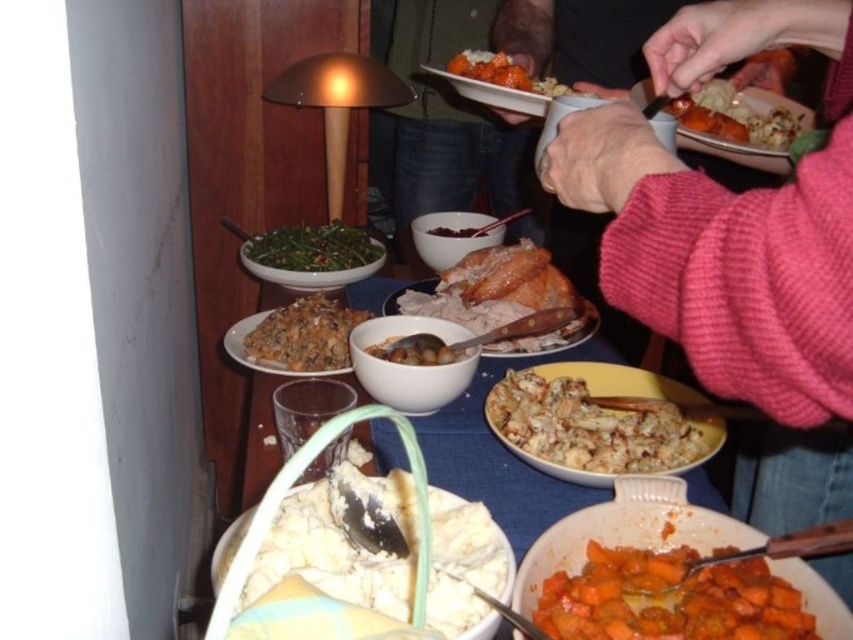
You are a guest at the table and want to place your napkin on the smooth white plate at center. However, there is also a golden brown roasted sweet potato at upper right nearby. Which object is wider so that the napkin can fit better?

The smooth white plate at center is wider than the golden brown roasted sweet potato at upper right, so the napkin will fit better on the smooth white plate at center.

You are standing in the dining area and want to reach the point marked as point (x=248, y=588) on the table. The table is 24 inches wide. Can you estimate if the point is within the table width?

The point (x=248, y=588) is 20.82 inches from the camera, which is within the table width of 24 inches. Therefore, the point is within the table width.

You are a guest at the table and want to reach for the white creamy mashed potatoes at center. Based on their position, where should you look to find them?

The white creamy mashed potatoes at center are located at point coordinates of 0.853 on the x axis and 0.397 on the y axis.